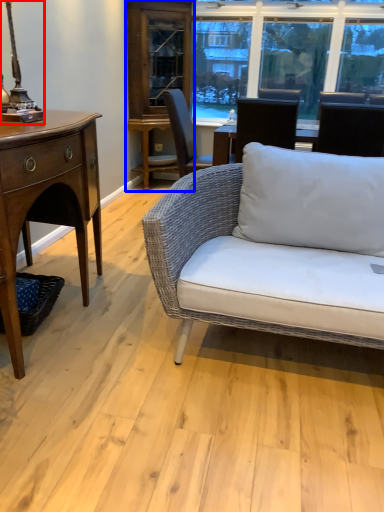
Question: Which point is further to the camera, table lamp (highlighted by a red box) or cabinetry (highlighted by a blue box)?

Choices:
 (A) table lamp
 (B) cabinetry

Answer: (B)